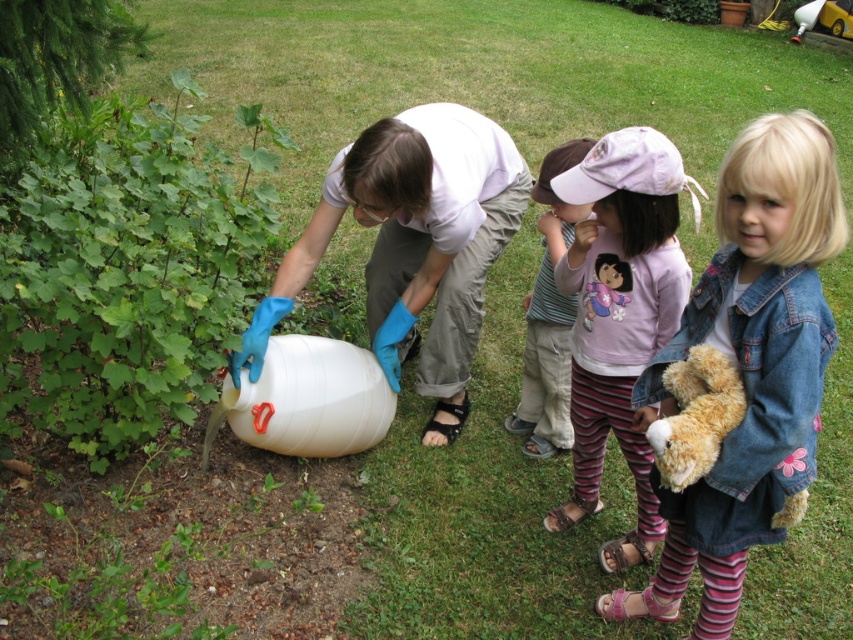
Is pink cotton hat at center bigger than brown plush teddy bear at lower right?

Yes, pink cotton hat at center is bigger than brown plush teddy bear at lower right.

Can you confirm if pink cotton hat at center is smaller than brown plush teddy bear at lower right?

Incorrect, pink cotton hat at center is not smaller in size than brown plush teddy bear at lower right.

Is point (556, 280) in front of point (714, 365)?

No.

You are a GUI agent. You are given a task and a screenshot of the screen. Output one action in this format:
    pyautogui.click(x=<x>, y=<y>)
    Task: Click on the pink cotton hat at center
    The width and height of the screenshot is (853, 640).
    Given the screenshot: What is the action you would take?
    pyautogui.click(x=619, y=316)

Does pink cotton hat at center appear over striped leggings at center?

Actually, pink cotton hat at center is below striped leggings at center.

Is point (642, 291) farther from viewer compared to point (558, 228)?

No, (642, 291) is in front of (558, 228).

Find the location of a particular element. pink cotton hat at center is located at coordinates (619, 316).

Looking at this image, who is higher up, white matte container at center-left or striped leggings at center?

white matte container at center-left

Does point (396, 182) come behind point (546, 196)?

That is False.

This screenshot has height=640, width=853. What are the coordinates of `white matte container at center-left` in the screenshot? It's located at (413, 244).